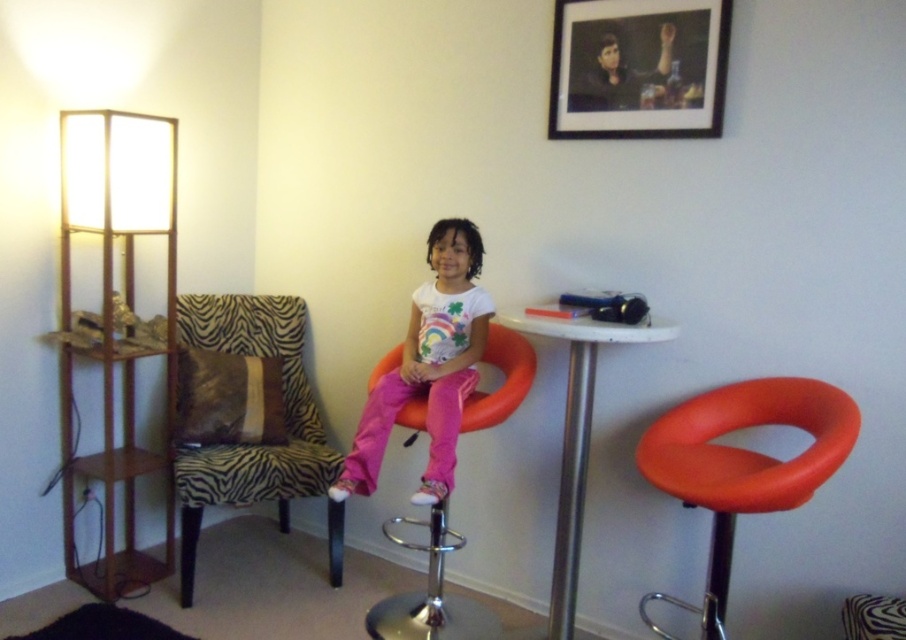
Question: Is zebra-patterned fabric chair at left further to the viewer compared to white glossy table at center?

Choices:
 (A) yes
 (B) no

Answer: (A)

Question: Which point appears farthest from the camera in this image?

Choices:
 (A) (610, 51)
 (B) (431, 484)

Answer: (A)

Question: Does pink fabric pants at center appear under orange matte stool at center?

Choices:
 (A) yes
 (B) no

Answer: (B)

Question: Which point is closer to the camera?

Choices:
 (A) orange matte stool at center
 (B) orange matte bar stool at center

Answer: (B)

Question: Which point is closer to the camera?

Choices:
 (A) (477, 250)
 (B) (442, 509)
 (C) (750, 392)
 (D) (581, 520)

Answer: (C)

Question: From the image, what is the correct spatial relationship of black matte picture frame at upper center in relation to white glossy table at center?

Choices:
 (A) above
 (B) below

Answer: (A)